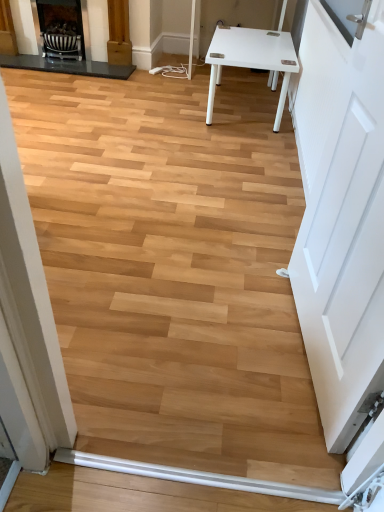
Question: Would you consider white matte door at right to be distant from matte black fireplace at upper left, acting as the 2th fireplace starting from the left?

Choices:
 (A) no
 (B) yes

Answer: (B)

Question: Can you confirm if white matte door at right is taller than matte black fireplace at upper left, acting as the 2th fireplace starting from the left?

Choices:
 (A) yes
 (B) no

Answer: (A)

Question: Could you tell me if white matte door at right is turned towards matte black fireplace at upper left, acting as the 2th fireplace starting from the left?

Choices:
 (A) yes
 (B) no

Answer: (B)

Question: Can you confirm if white matte door at right is wider than matte black fireplace at upper left, which is the first fireplace from right to left?

Choices:
 (A) yes
 (B) no

Answer: (B)

Question: Is white matte door at right beside matte black fireplace at upper left, acting as the 2th fireplace starting from the left?

Choices:
 (A) yes
 (B) no

Answer: (B)

Question: From a real-world perspective, is white matte door at right below matte black fireplace at upper left, which is the first fireplace from right to left?

Choices:
 (A) no
 (B) yes

Answer: (A)

Question: Is matte black fireplace at upper left, which is the 1th fireplace in left-to-right order, facing towards white matte door at right?

Choices:
 (A) yes
 (B) no

Answer: (A)

Question: Can white matte door at right be found inside matte black fireplace at upper left, the 2th fireplace positioned from the right?

Choices:
 (A) no
 (B) yes

Answer: (A)

Question: From a real-world perspective, is matte black fireplace at upper left, the 2th fireplace positioned from the right, physically above white matte door at right?

Choices:
 (A) no
 (B) yes

Answer: (A)

Question: Is matte black fireplace at upper left, the 2th fireplace positioned from the right, not within white matte door at right?

Choices:
 (A) no
 (B) yes

Answer: (B)

Question: Considering the relative positions of matte black fireplace at upper left, which is the 1th fireplace in left-to-right order, and white matte door at right in the image provided, is matte black fireplace at upper left, which is the 1th fireplace in left-to-right order, behind white matte door at right?

Choices:
 (A) yes
 (B) no

Answer: (A)

Question: Does matte black fireplace at upper left, the 2th fireplace positioned from the right, appear on the left side of white matte door at right?

Choices:
 (A) no
 (B) yes

Answer: (B)

Question: Is matte black fireplace at upper left, the 2th fireplace positioned from the right, positioned with its back to matte black fireplace at upper left, which is the first fireplace from right to left?

Choices:
 (A) yes
 (B) no

Answer: (A)